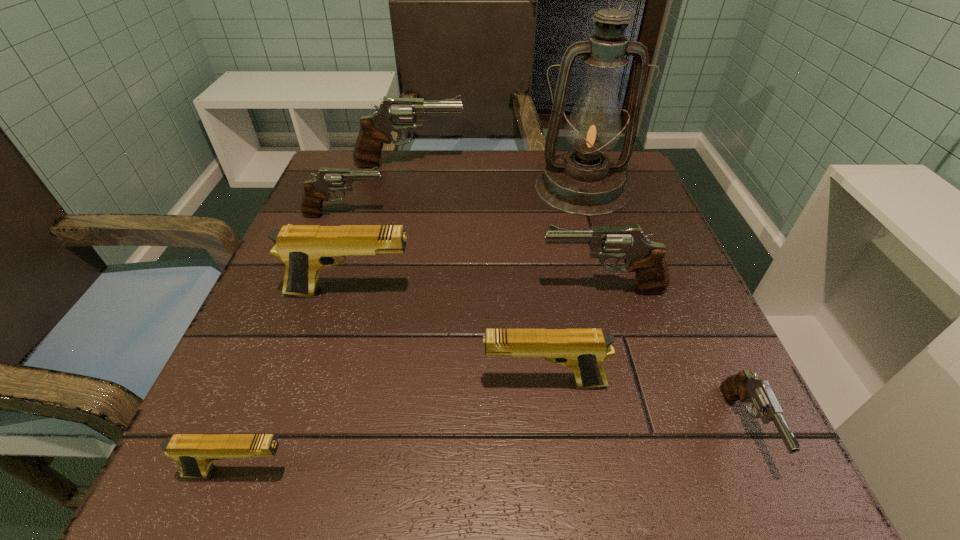
Identify the location of vacant space that satisfies the following two spatial constraints: 1. at the barrel of the rightmost gray pistol; 2. at the barrel of the nearest tan pistol. (764, 472).